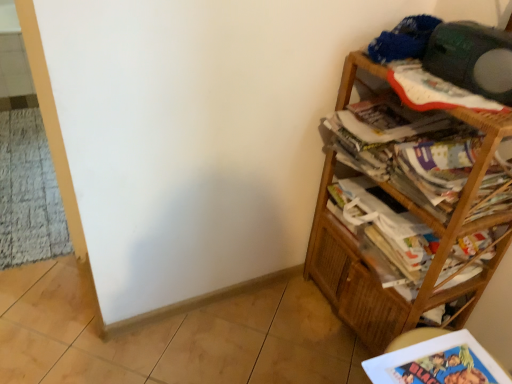
Question: Could you tell me if white glossy book at lower right is turned towards wooden bookcase at right?

Choices:
 (A) yes
 (B) no

Answer: (B)

Question: Does white glossy book at lower right have a greater width compared to wooden bookcase at right?

Choices:
 (A) no
 (B) yes

Answer: (A)

Question: Does white glossy book at lower right appear on the left side of wooden bookcase at right?

Choices:
 (A) yes
 (B) no

Answer: (A)

Question: Is wooden bookcase at right at the back of white glossy book at lower right?

Choices:
 (A) no
 (B) yes

Answer: (A)

Question: Considering the relative sizes of white glossy book at lower right and wooden bookcase at right in the image provided, is white glossy book at lower right shorter than wooden bookcase at right?

Choices:
 (A) yes
 (B) no

Answer: (A)

Question: Can you confirm if white glossy book at lower right is positioned to the right of wooden bookcase at right?

Choices:
 (A) yes
 (B) no

Answer: (B)

Question: Is green matte speaker at upper right next to printed paper magazine at right, positioned as the second magazine in bottom-to-top order, and touching it?

Choices:
 (A) no
 (B) yes

Answer: (A)

Question: Can you confirm if green matte speaker at upper right is thinner than printed paper magazine at right, the first magazine when ordered from top to bottom?

Choices:
 (A) no
 (B) yes

Answer: (B)

Question: From the image's perspective, is green matte speaker at upper right above printed paper magazine at right, positioned as the second magazine in bottom-to-top order?

Choices:
 (A) yes
 (B) no

Answer: (A)

Question: Does green matte speaker at upper right lie in front of printed paper magazine at right, the first magazine when ordered from top to bottom?

Choices:
 (A) no
 (B) yes

Answer: (B)

Question: From the image's perspective, is green matte speaker at upper right located beneath printed paper magazine at right, the first magazine when ordered from top to bottom?

Choices:
 (A) yes
 (B) no

Answer: (B)

Question: Is green matte speaker at upper right aimed at printed paper magazine at right, positioned as the second magazine in bottom-to-top order?

Choices:
 (A) yes
 (B) no

Answer: (B)

Question: Is printed paper magazine at right, positioned as the second magazine in bottom-to-top order, positioned behind wooden bookcase at right?

Choices:
 (A) no
 (B) yes

Answer: (B)